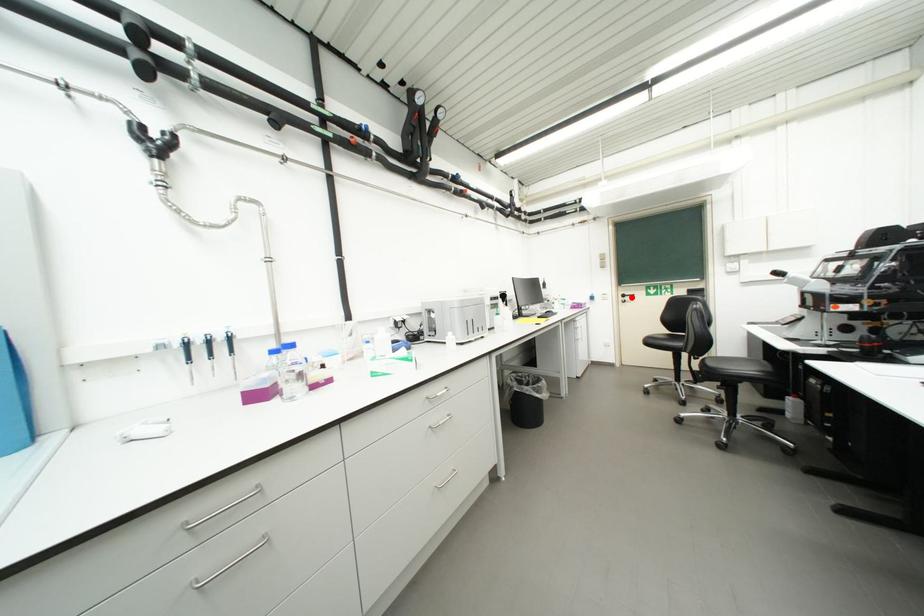
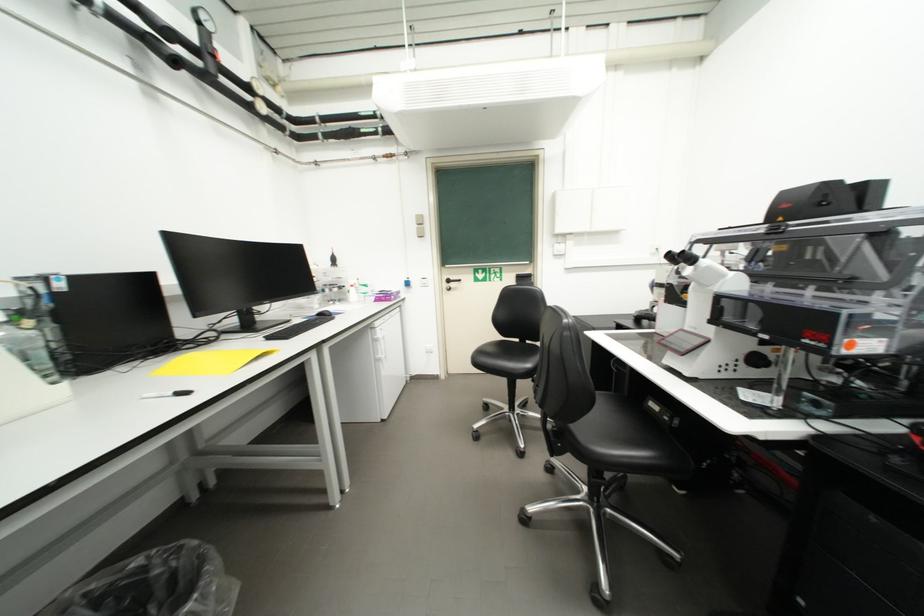
Where in the second image is the point corresponding to the highlighted location from the first image?

(456, 283)